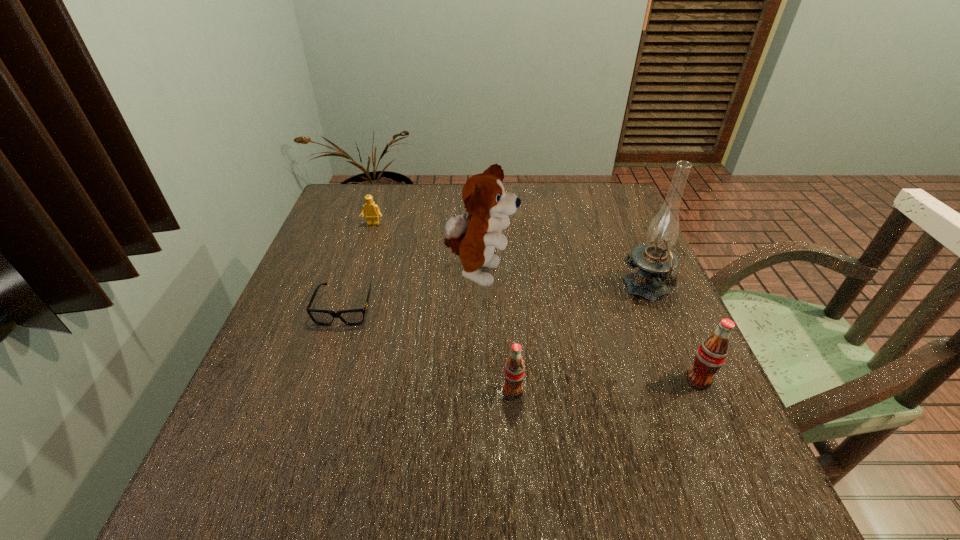
Please point a spot on the left to add another soda. Please provide its 2D coordinates. Your answer should be formatted as a tuple, i.e. [(x, y)], where the tuple contains the x and y coordinates of a point satisfying the conditions above.

[(319, 403)]